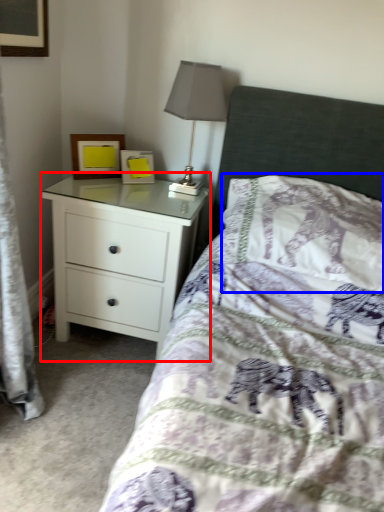
Question: Among these objects, which one is farthest to the camera, chest of drawers (highlighted by a red box) or pillow (highlighted by a blue box)?

Choices:
 (A) chest of drawers
 (B) pillow

Answer: (A)